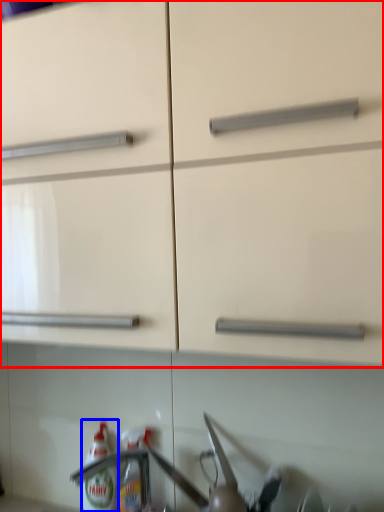
Question: Which object appears closest to the camera in this image, cabinetry (highlighted by a red box) or bottle (highlighted by a blue box)?

Choices:
 (A) cabinetry
 (B) bottle

Answer: (A)